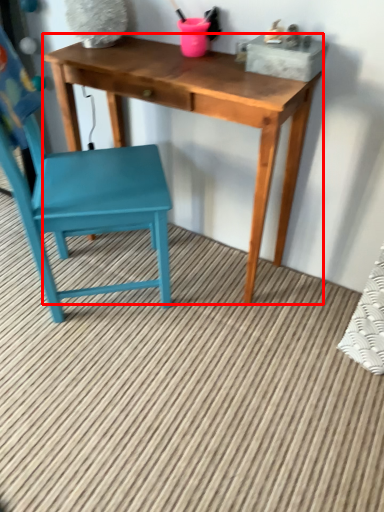
Question: From the image, what is the correct spatial relationship of table (annotated by the red box) in relation to chair?

Choices:
 (A) right
 (B) left

Answer: (A)